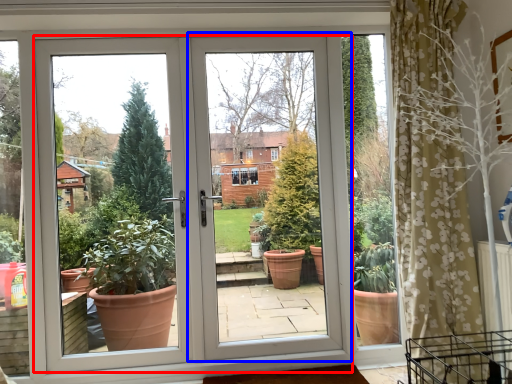
Question: Which of the following is the farthest to the observer, door (highlighted by a red box) or screen door (highlighted by a blue box)?

Choices:
 (A) door
 (B) screen door

Answer: (B)